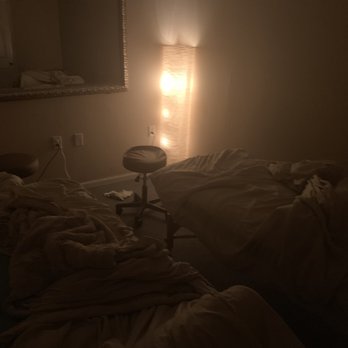
Find the location of a particular element. This screenshot has width=348, height=348. sock is located at coordinates (114, 192).